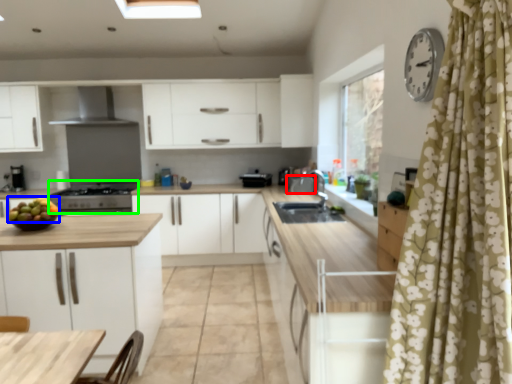
Question: Which object is positioned closest to appliance (highlighted by a red box)? Select from fruit (highlighted by a blue box) and appliance (highlighted by a green box).

Choices:
 (A) fruit
 (B) appliance

Answer: (B)